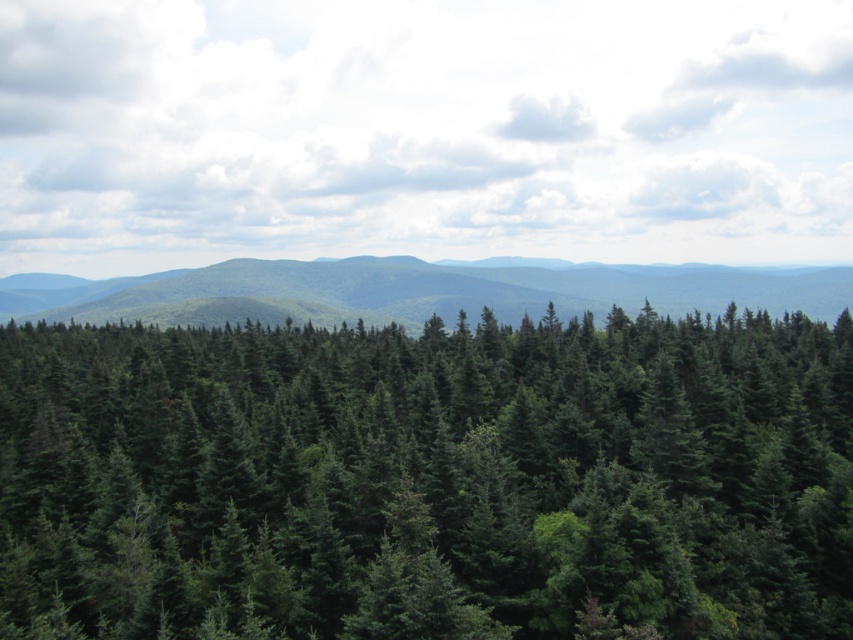
You are a hiker standing at the origin point of the forest map. You want to reach the green matte pine forest at center. What are the coordinates you should head towards?

The coordinates to reach the green matte pine forest at center are point (428,480).

You are a hiker trying to navigate through the green matte pine forest at center and the green matte forest at center. Which forest area should you choose if you want to travel through the smaller one?

The green matte pine forest at center has a smaller size compared to the green matte forest at center, so you should choose the green matte pine forest at center.